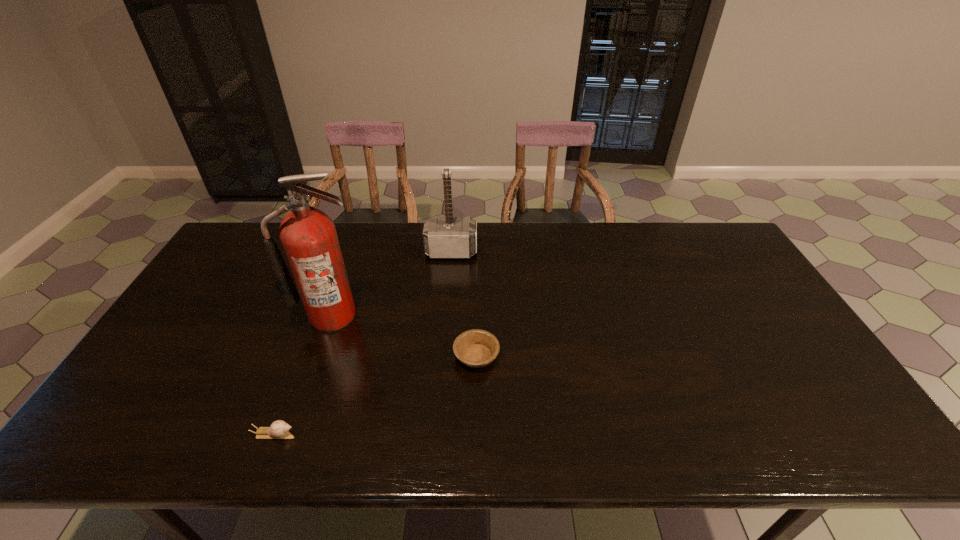
Where is `vacant space that satisfies the following two spatial constraints: 1. on the front of the bowl near the operation label; 2. on the left side of the fire extinguisher`? The height and width of the screenshot is (540, 960). vacant space that satisfies the following two spatial constraints: 1. on the front of the bowl near the operation label; 2. on the left side of the fire extinguisher is located at coordinates (318, 356).

The height and width of the screenshot is (540, 960). Find the location of `free location that satisfies the following two spatial constraints: 1. for striking with the head of the hammer; 2. on the shell of the nearest object`. free location that satisfies the following two spatial constraints: 1. for striking with the head of the hammer; 2. on the shell of the nearest object is located at coordinates (437, 434).

The image size is (960, 540). I want to click on vacant area that satisfies the following two spatial constraints: 1. on the front of the tallest object near the operation label; 2. on the shell of the nearest object, so click(291, 434).

The width and height of the screenshot is (960, 540). Identify the location of free location that satisfies the following two spatial constraints: 1. on the front of the second farthest object near the operation label; 2. on the shell of the nearest object. (291, 434).

Where is `vacant area in the image that satisfies the following two spatial constraints: 1. on the front of the third nearest object near the operation label; 2. on the shell of the nearest object`? The width and height of the screenshot is (960, 540). vacant area in the image that satisfies the following two spatial constraints: 1. on the front of the third nearest object near the operation label; 2. on the shell of the nearest object is located at coordinates (291, 434).

Identify the location of free region that satisfies the following two spatial constraints: 1. on the front of the third nearest object near the operation label; 2. on the left side of the bowl. (318, 356).

Image resolution: width=960 pixels, height=540 pixels. I want to click on free point that satisfies the following two spatial constraints: 1. on the front of the fire extinguisher near the operation label; 2. on the shell of the nearest object, so click(291, 434).

In order to click on free space that satisfies the following two spatial constraints: 1. for striking with the head of the third shortest object; 2. on the right side of the third farthest object in this screenshot , I will do `click(444, 356)`.